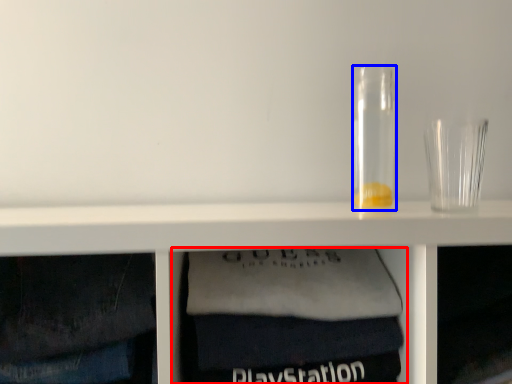
Question: Which object is further to the camera taking this photo, cabinet (highlighted by a red box) or glass jar (highlighted by a blue box)?

Choices:
 (A) cabinet
 (B) glass jar

Answer: (B)